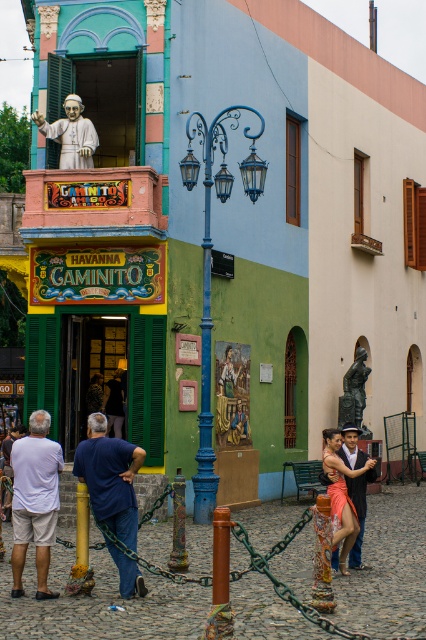
In the scene shown: You are a tourist standing on the street looking at the Havanna Gaminito building. You see a bronze statue at center and a brushed metal pole at center. Which object is closer to your right side?

The bronze statue at center is closer to your right side because it is positioned to the right of the brushed metal pole at center.

You are a photographer planning to take a photo of the vibrant street scene with the Havanna Gaminito building in the background. You notice two people in the foreground wearing a blue cotton shirt at lower left and a matte pink dress at center. Which clothing item would you focus on to ensure it stands out more in the photo due to its size?

The matte pink dress at center would stand out more because it occupies more space than the blue cotton shirt at lower left.

You are a delivery person who needs to place a 35 meter long banner between the bronze statue at center and the brushed metal pole at center. Can you fit the banner between them?

The bronze statue at center and the brushed metal pole at center are 34.53 meters apart from each other. Since the banner is 35 meters long, it is slightly longer than the distance between them, so it cannot be placed between them without overlapping or bending the banner.